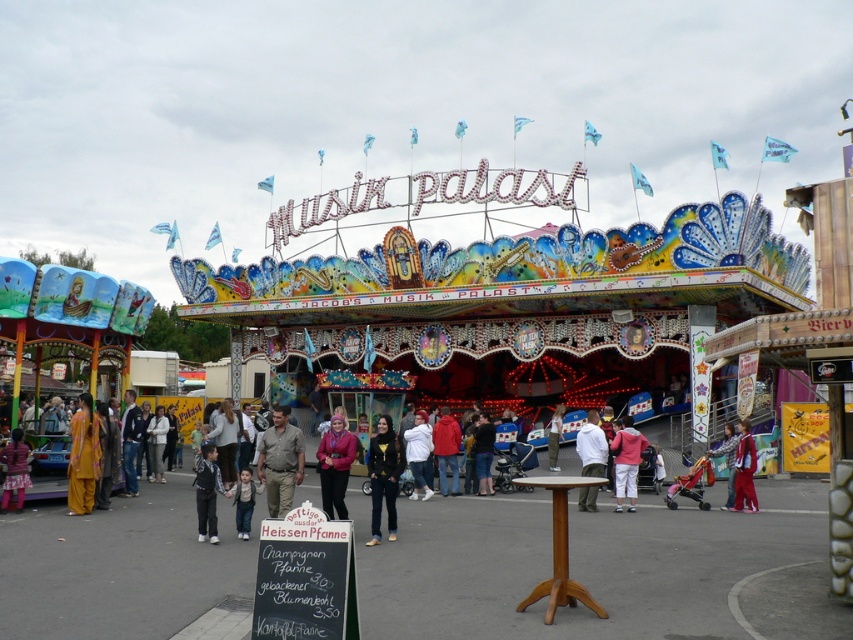
Question: Considering the real-world distances, which object is farthest from the white matte jacket at center?

Choices:
 (A) red matte jacket at center
 (B) black leather jacket at center

Answer: (B)

Question: Can you confirm if brown leather jacket at center is smaller than dark blue jeans at lower left?

Choices:
 (A) yes
 (B) no

Answer: (B)

Question: Among these points, which one is nearest to the camera?

Choices:
 (A) (439, 429)
 (B) (346, 476)
 (C) (630, 504)
 (D) (746, 472)

Answer: (D)

Question: Among these points, which one is nearest to the camera?

Choices:
 (A) click(735, 444)
 (B) click(328, 435)
 (C) click(201, 477)

Answer: (C)

Question: Can you confirm if light brown fabric pants at lower center is smaller than white cotton shirt at center?

Choices:
 (A) no
 (B) yes

Answer: (A)

Question: Does white fleece jacket at center appear under matte pink pants at lower left?

Choices:
 (A) yes
 (B) no

Answer: (A)